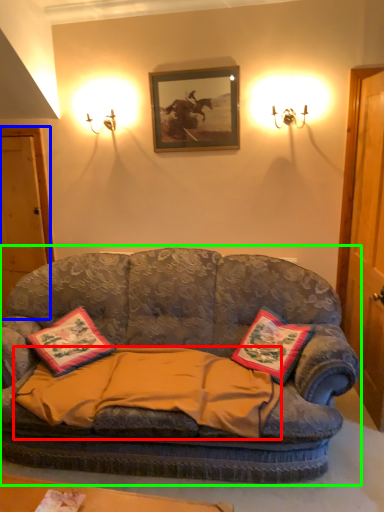
Question: Based on their relative distances, which object is nearer to blanket (highlighted by a red box)? Choose from door (highlighted by a blue box) and studio couch (highlighted by a green box).

Choices:
 (A) door
 (B) studio couch

Answer: (B)